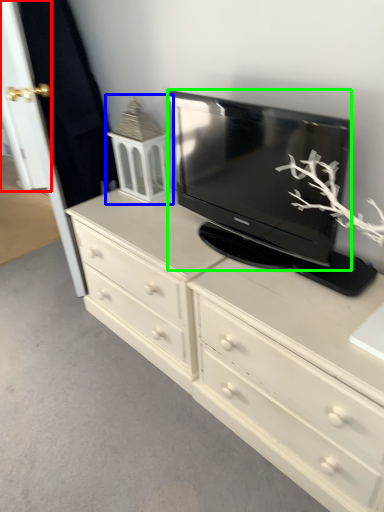
Question: Based on their relative distances, which object is nearer to door (highlighted by a red box)? Choose from tv cabinet (highlighted by a blue box) and television (highlighted by a green box).

Choices:
 (A) tv cabinet
 (B) television

Answer: (A)